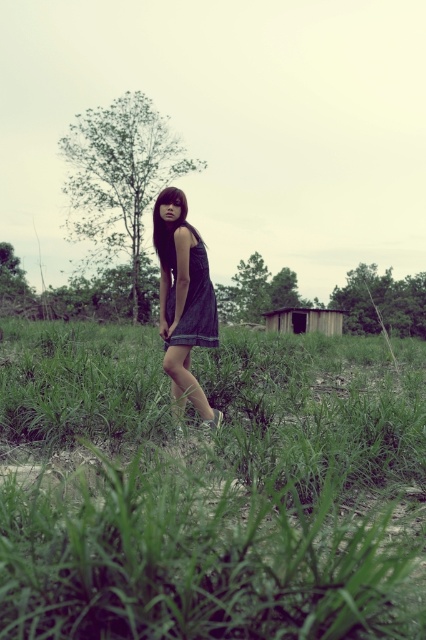
You are a fashion designer observing the scene. You need to decide which dress to recommend for a client who prefers a more relaxed fit. Based on the image, which dress between the denim dress at center and the satin dress at center would you suggest?

The denim dress at center has a greater width than the satin dress at center, making it a better choice for a relaxed fit.

You are a photographer wanting to capture the scene with the satin dress at center and the wooden hut at center. The client wants the dress to be fully visible without any obstruction. Based on the description, is the current arrangement suitable?

The satin dress at center is positioned under the wooden hut at center, so the wooden hut may block part of the dress from view. To ensure the dress is fully visible, you might need to adjust the angle or position to avoid the wooden hut obstructing it.